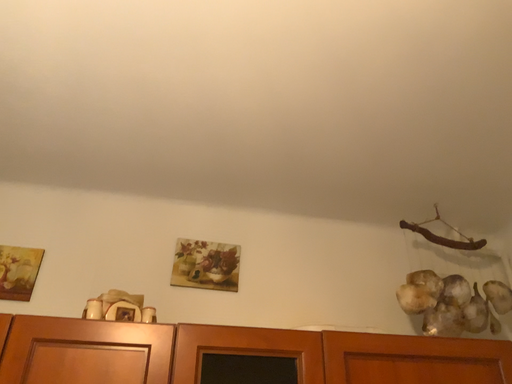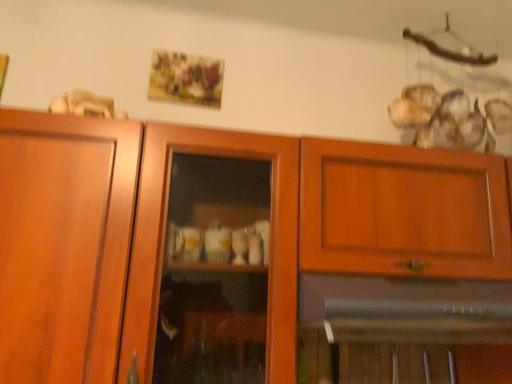
Question: Which way did the camera rotate in the video?

Choices:
 (A) rotated downward
 (B) rotated upward

Answer: (A)